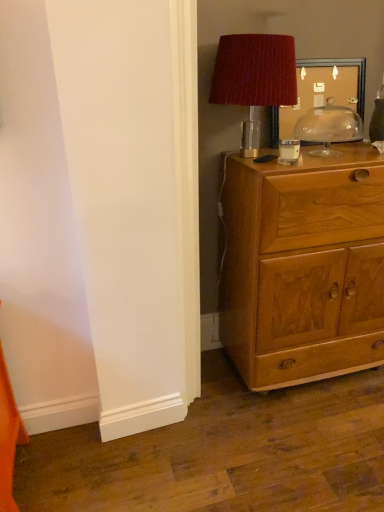
Question: Is wooden picture frame at upper right facing away from transparent glass dome at upper right?

Choices:
 (A) no
 (B) yes

Answer: (B)

Question: Does wooden picture frame at upper right have a greater width compared to transparent glass dome at upper right?

Choices:
 (A) yes
 (B) no

Answer: (B)

Question: From a real-world perspective, is wooden picture frame at upper right physically below transparent glass dome at upper right?

Choices:
 (A) yes
 (B) no

Answer: (B)

Question: Does wooden picture frame at upper right have a lesser width compared to transparent glass dome at upper right?

Choices:
 (A) no
 (B) yes

Answer: (B)

Question: Can you confirm if wooden picture frame at upper right is taller than transparent glass dome at upper right?

Choices:
 (A) no
 (B) yes

Answer: (B)

Question: From a real-world perspective, is transparent glass dome at upper right physically located above or below wooden cabinet at right?

Choices:
 (A) below
 (B) above

Answer: (B)

Question: Would you say transparent glass dome at upper right is to the left or to the right of wooden cabinet at right in the picture?

Choices:
 (A) right
 (B) left

Answer: (B)

Question: In terms of width, does transparent glass dome at upper right look wider or thinner when compared to wooden cabinet at right?

Choices:
 (A) thin
 (B) wide

Answer: (A)

Question: Does point (332, 138) appear closer or farther from the camera than point (296, 226)?

Choices:
 (A) closer
 (B) farther

Answer: (B)

Question: Considering the relative positions of transparent glass dome at upper right and wooden picture frame at upper right in the image provided, is transparent glass dome at upper right to the left or to the right of wooden picture frame at upper right?

Choices:
 (A) left
 (B) right

Answer: (B)

Question: Do you think transparent glass dome at upper right is within wooden picture frame at upper right, or outside of it?

Choices:
 (A) outside
 (B) inside

Answer: (A)

Question: In terms of size, does transparent glass dome at upper right appear bigger or smaller than wooden picture frame at upper right?

Choices:
 (A) big
 (B) small

Answer: (B)

Question: Is transparent glass dome at upper right in front of or behind wooden picture frame at upper right in the image?

Choices:
 (A) front
 (B) behind

Answer: (A)

Question: Is wooden cabinet at right inside the boundaries of velvet red lampshade at upper right, or outside?

Choices:
 (A) outside
 (B) inside

Answer: (A)

Question: Is wooden cabinet at right wider or thinner than velvet red lampshade at upper right?

Choices:
 (A) wide
 (B) thin

Answer: (A)